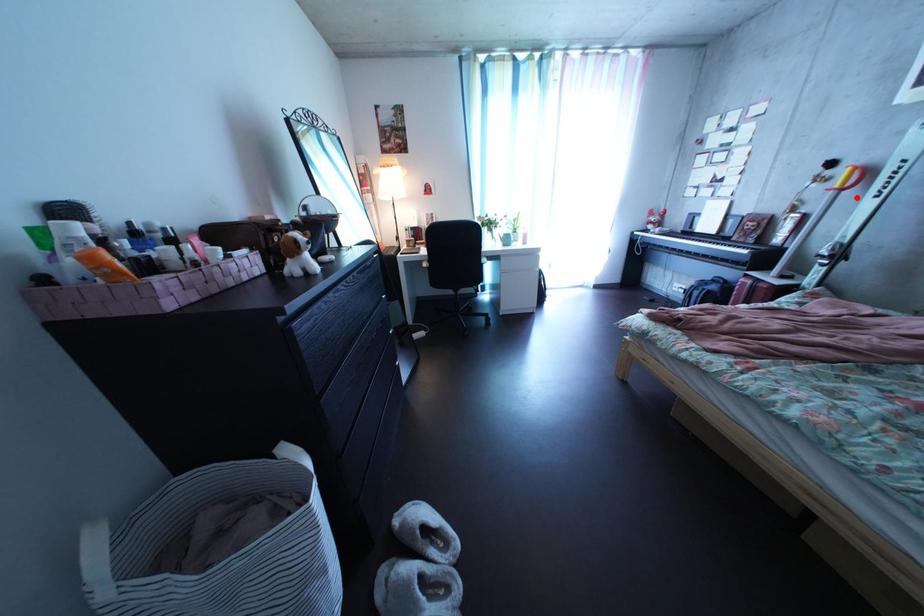
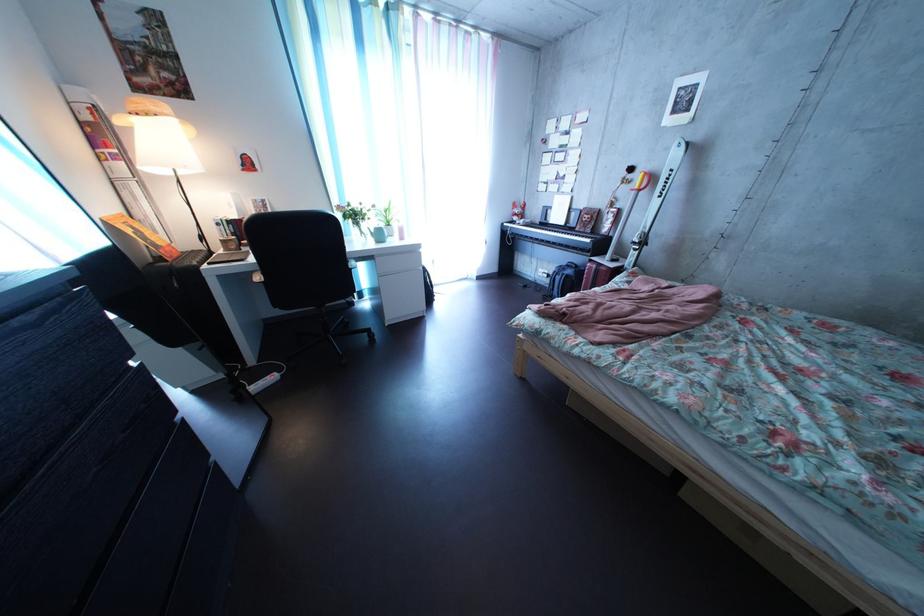
Question: I am providing you with two images of the same scene from different viewpoints. A red point is marked on the first image. Is the red point's position out of view in image 2?

Choices:
 (A) Yes
 (B) No

Answer: (B)